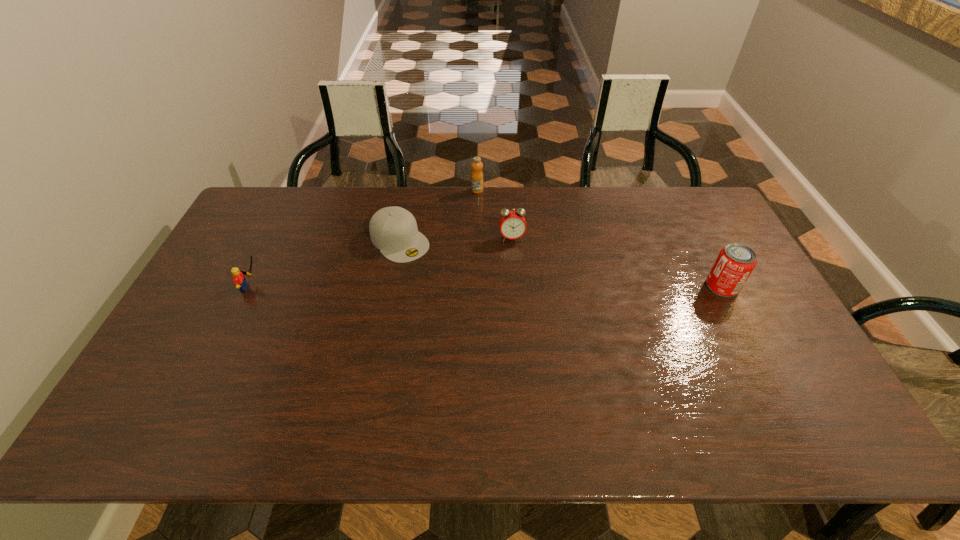
Where is `vacant area situated 0.380m on the front-facing side of the shortest object`? The image size is (960, 540). vacant area situated 0.380m on the front-facing side of the shortest object is located at coordinates (493, 335).

The height and width of the screenshot is (540, 960). Identify the location of free point located on the front-facing side of the shortest object. (491, 333).

Identify the location of free region located 0.250m on the front-facing side of the alarm clock. (523, 302).

Locate an element on the screen. vacant space located 0.100m on the front-facing side of the alarm clock is located at coordinates (516, 265).

The image size is (960, 540). What are the coordinates of `blank space located 0.270m on the front-facing side of the alarm clock` in the screenshot? It's located at click(524, 307).

Image resolution: width=960 pixels, height=540 pixels. Find the location of `vacant space located on the front label of the farthest object`. vacant space located on the front label of the farthest object is located at coordinates (489, 213).

The image size is (960, 540). I want to click on vacant space located 0.070m on the front label of the farthest object, so click(485, 205).

Where is `vacant space located on the front label of the farthest object`? vacant space located on the front label of the farthest object is located at coordinates (498, 231).

Image resolution: width=960 pixels, height=540 pixels. In order to click on cap at the far edge in this screenshot , I will do `click(393, 230)`.

Locate an element on the screen. orange juice that is at the far edge is located at coordinates (477, 175).